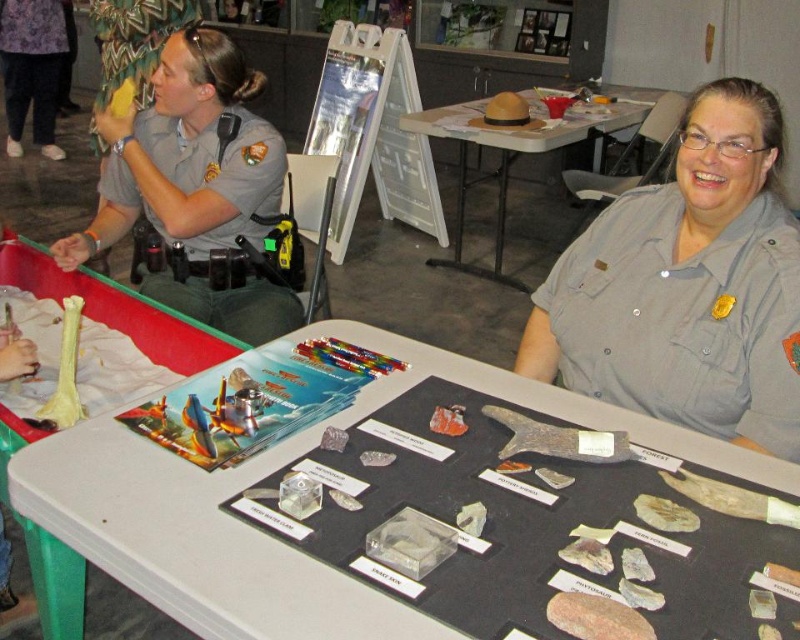
You are standing in front of the educational booth and want to reach a point that is exactly 2 meters away from you. Is the point at coordinates point (122, 310) within that distance?

The point at point (122, 310) is 1.94 meters away from the viewer, so yes, it is within the 2 meters distance.

You are a visitor at an event booth and notice the white plastic table at left and the purple fabric pants at upper left. Which object takes up more space in the scene?

The purple fabric pants at upper left takes up more space in the scene because the white plastic table at left is smaller than purple fabric pants at upper left.

You are a visitor at the booth and want to locate the translucent glass bone at lower left and the white plastic table at left. According to the scene, which object is positioned to the right of the other?

The translucent glass bone at lower left is positioned to the right of the white plastic table at left.